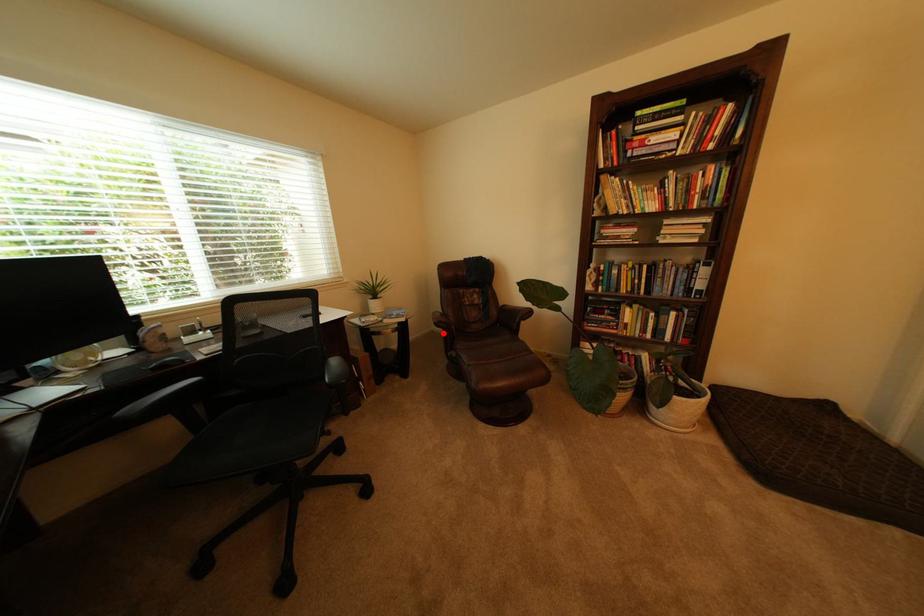
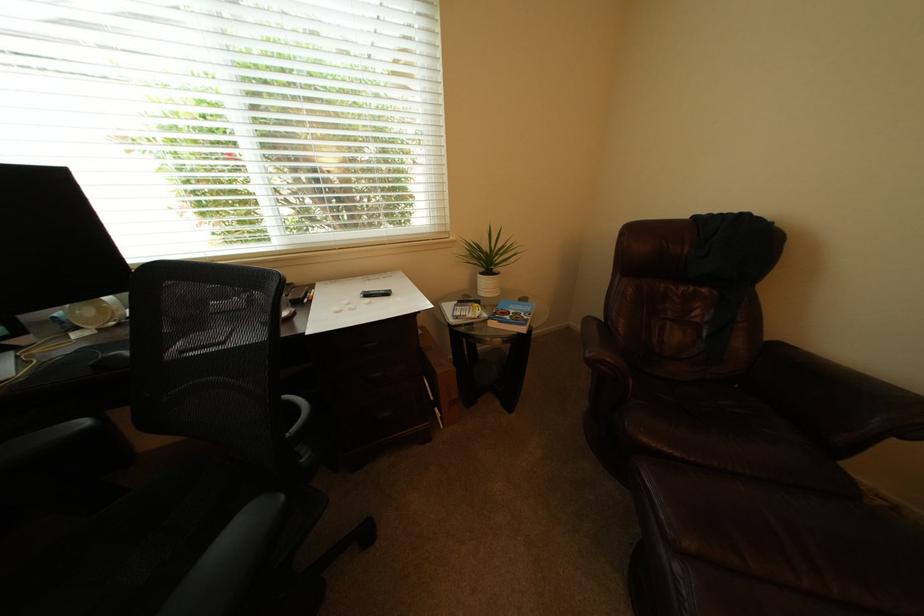
Locate, in the second image, the point that corresponds to the highlighted location in the first image.

(579, 331)